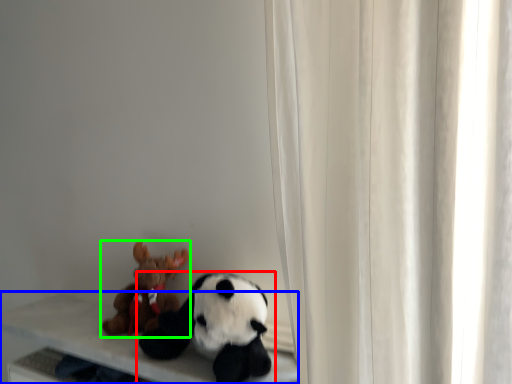
Question: Estimate the real-world distances between objects in this image. Which object is closer to toy (highlighted by a red box), table (highlighted by a blue box) or toy (highlighted by a green box)?

Choices:
 (A) table
 (B) toy

Answer: (A)